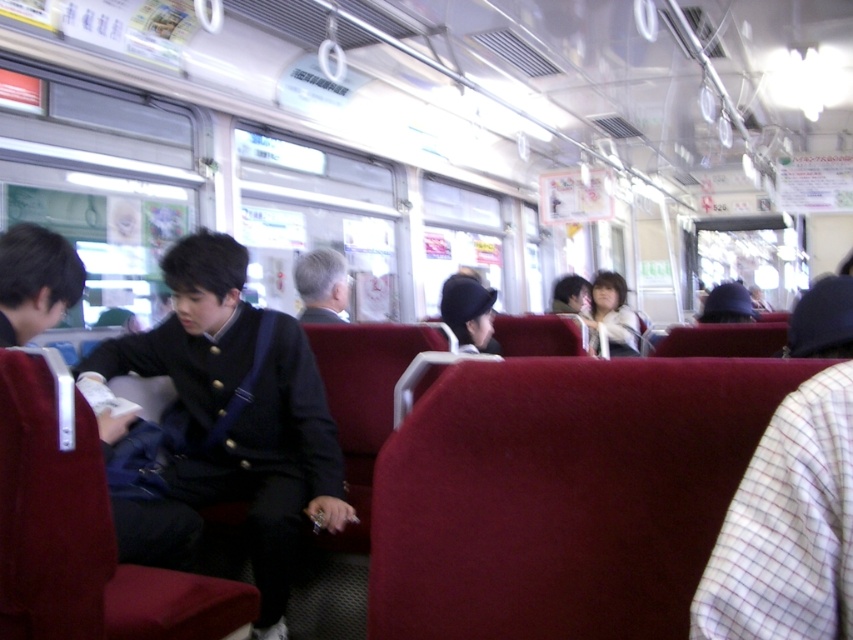
You are a passenger on this train and want to place a small bag on the seat next to you. The seat has both the white checkered fabric at right and the white fuzzy jacket at center. Which object should you avoid placing the bag on to ensure it doesn not obstruct anything?

You should avoid placing the bag on the white checkered fabric at right because it is positioned under the white fuzzy jacket at center, meaning the jacket is above it and placing the bag there might displace the jacket or cause obstruction.

You are a passenger on this train and want to know if the matte black jacket at center is taller than the white checkered fabric at right. Can you confirm this based on the scene?

The matte black jacket at center has a greater height compared to the white checkered fabric at right, so yes, the matte black jacket at center is taller than the white checkered fabric at right.

What is the color of the object where the point at coordinates (239, 410) is located?

The point at coordinates (239, 410) is located on a matte black jacket at center, so the color is matte black.